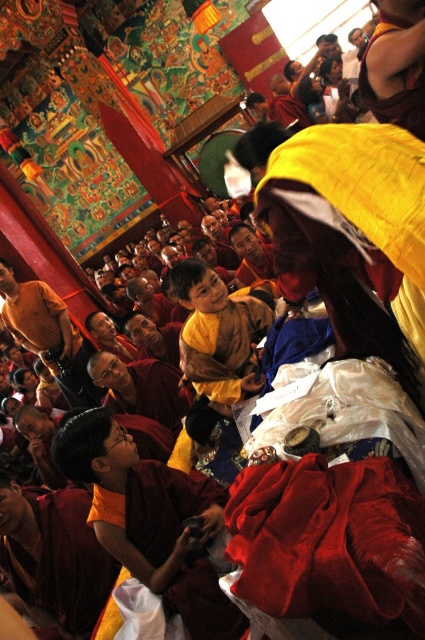
You are a visitor in the temple and notice two items on the floor. The velvet red cloth at lower right and the orange cotton robe at lower left. Which item is covering part of the other?

The velvet red cloth at lower right is positioned over the orange cotton robe at lower left, so it is covering part of it.

You are a visitor in this temple and need to reach the yellow cotton monk at upper right to ask a question. The orange cotton robe at lower left is blocking your path. Can you walk around it? Explain why or why not based on the distance between them.

The distance between the orange cotton robe at lower left and the yellow cotton monk at upper right is 88.66 feet. Since the orange cotton robe is only blocking part of the path, there is enough space to walk around it to reach the yellow cotton monk at upper right.